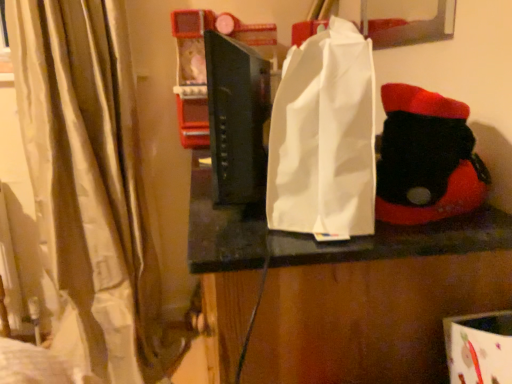
Describe the element at coordinates (376, 300) in the screenshot. The image size is (512, 384). I see `white paper bag at center` at that location.

This screenshot has width=512, height=384. Describe the element at coordinates (95, 186) in the screenshot. I see `beige fabric curtain at left` at that location.

Find the location of a particular element. Image resolution: width=512 pixels, height=384 pixels. black felt boot at right is located at coordinates (426, 158).

Considering the relative sizes of white paper bag at center and black matte book at center in the image provided, is white paper bag at center bigger than black matte book at center?

Indeed, white paper bag at center has a larger size compared to black matte book at center.

Is white paper bag at center not near black matte book at center?

No, white paper bag at center is not far away from black matte book at center.

How many degrees apart are the facing directions of white paper bag at center and black matte book at center?

0.86 degrees.

From a real-world perspective, does white paper bag at center sit lower than beige fabric curtain at left?

No, from a real-world perspective, white paper bag at center is not below beige fabric curtain at left.

Locate an element on the screen. grocery bag in front of the beige fabric curtain at left is located at coordinates (324, 138).

From the image's perspective, who appears lower, white paper bag at center or beige fabric curtain at left?

beige fabric curtain at left appears lower in the image.

Is white paper bag at center further to camera compared to beige fabric curtain at left?

No, white paper bag at center is closer to the camera.

This screenshot has width=512, height=384. What are the coordinates of `toy beneath the black matte book at center (from a real-world perspective)` in the screenshot? It's located at (426, 158).

Are black felt boot at right and black matte book at center located far from each other?

No, there isn't a large distance between black felt boot at right and black matte book at center.

Looking at this image, from the image's perspective, is black felt boot at right below black matte book at center?

Yes, from the image's perspective, black felt boot at right is beneath black matte book at center.

Based on the photo, between black felt boot at right and black matte book at center, which one appears on the right side from the viewer's perspective?

black felt boot at right is more to the right.

Is beige fabric curtain at left directly adjacent to black felt boot at right?

No, beige fabric curtain at left is not beside black felt boot at right.

Is beige fabric curtain at left bigger than black felt boot at right?

Indeed, beige fabric curtain at left has a larger size compared to black felt boot at right.

From a real-world perspective, is beige fabric curtain at left on top of black felt boot at right?

No, from a real-world perspective, beige fabric curtain at left is not on top of black felt boot at right.

Would you say beige fabric curtain at left is to the left or to the right of black felt boot at right in the picture?

Based on their positions, beige fabric curtain at left is located to the left of black felt boot at right.

Based on the photo, considering the relative positions of black matte book at center and white paper bag at center in the image provided, is black matte book at center in front of white paper bag at center?

No, it is not.

Can you confirm if black matte book at center is wider than white paper bag at center?

Incorrect, the width of black matte book at center does not surpass that of white paper bag at center.

Does point (216, 64) lie in front of point (275, 324)?

No.

Considering the relative sizes of black matte book at center and white paper bag at center in the image provided, is black matte book at center smaller than white paper bag at center?

Yes.

How much distance is there between black matte book at center and beige fabric curtain at left?

black matte book at center is 29.97 inches away from beige fabric curtain at left.

Which object is further away from the camera, black matte book at center or beige fabric curtain at left?

beige fabric curtain at left is further from the camera.

How different are the orientations of black matte book at center and beige fabric curtain at left in degrees?

The angular difference between black matte book at center and beige fabric curtain at left is 106 degrees.

Considering the sizes of black matte book at center and beige fabric curtain at left in the image, is black matte book at center bigger or smaller than beige fabric curtain at left?

Considering their sizes, black matte book at center takes up less space than beige fabric curtain at left.

Looking at this image, is black matte book at center positioned beyond the bounds of black felt boot at right?

Yes, black matte book at center is not within black felt boot at right.

From the image's perspective, does black matte book at center appear higher than black felt boot at right?

Yes, from the image's perspective, black matte book at center is above black felt boot at right.

Does point (240, 137) lie in front of point (460, 141)?

No, (240, 137) is further to viewer.

In the image, there is a black matte book at center. Where is `grocery bag below it (from the image's perspective)`? grocery bag below it (from the image's perspective) is located at coordinates (324, 138).

The image size is (512, 384). In order to click on curtain behind the white paper bag at center in this screenshot , I will do `click(95, 186)`.

Considering their positions, is beige fabric curtain at left positioned further to white paper bag at center than black matte book at center?

The object further to white paper bag at center is beige fabric curtain at left.

Which object lies nearer to the anchor point black matte book at center, white paper bag at center or black felt boot at right?

The object closer to black matte book at center is white paper bag at center.

When comparing their distances from white paper bag at center, does beige fabric curtain at left or white paper bag at center seem further?

beige fabric curtain at left is further to white paper bag at center.

From the image, which object appears to be farther from black felt boot at right, white paper bag at center or white paper bag at center?

white paper bag at center is positioned further to the anchor black felt boot at right.

When comparing their distances from black matte book at center, does white paper bag at center or black felt boot at right seem closer?

Based on the image, white paper bag at center appears to be nearer to black matte book at center.

When comparing their distances from beige fabric curtain at left, does white paper bag at center or black matte book at center seem further?

white paper bag at center lies further to beige fabric curtain at left than the other object.

From the image, which object appears to be nearer to white paper bag at center, black matte book at center or beige fabric curtain at left?

black matte book at center.

Estimate the real-world distances between objects in this image. Which object is closer to black matte book at center, black felt boot at right or beige fabric curtain at left?

black felt boot at right is positioned closer to the anchor black matte book at center.

The height and width of the screenshot is (384, 512). I want to click on grocery bag that lies between black matte book at center and white paper bag at center from top to bottom, so click(x=324, y=138).

Where is `book between beige fabric curtain at left and white paper bag at center`? The width and height of the screenshot is (512, 384). book between beige fabric curtain at left and white paper bag at center is located at coordinates (237, 119).

Locate an element on the screen. The width and height of the screenshot is (512, 384). grocery bag between beige fabric curtain at left and black felt boot at right from left to right is located at coordinates (324, 138).

At what (x,y) coordinates should I click in order to perform the action: click on book located between beige fabric curtain at left and black felt boot at right in the left-right direction. Please return your answer as a coordinate pair (x, y). The width and height of the screenshot is (512, 384). Looking at the image, I should click on (237, 119).